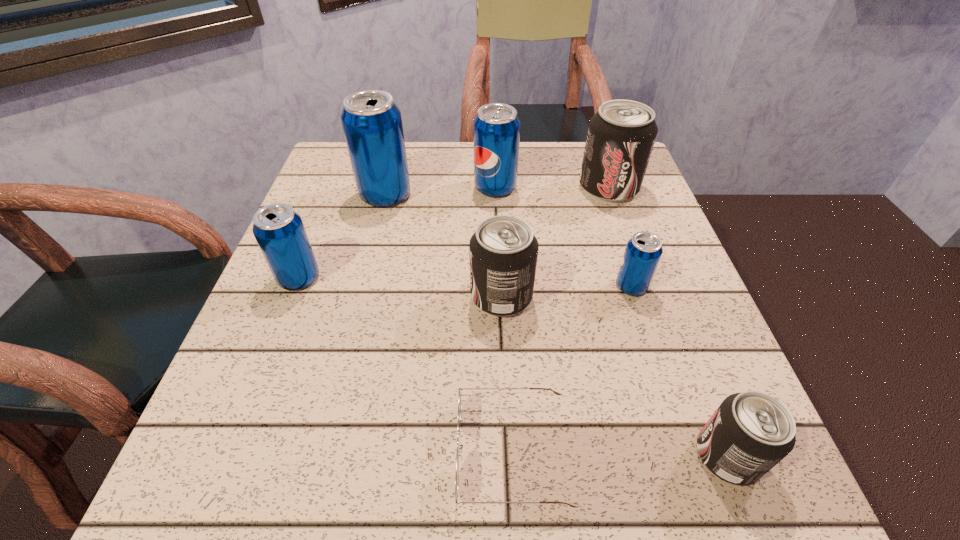
Find the location of a particular element. This screenshot has width=960, height=540. black soda can that is the closest one to the leftmost object is located at coordinates (503, 251).

Locate an element on the screen. black soda can that is the nearest to the rightmost blue pop soda is located at coordinates tap(503, 251).